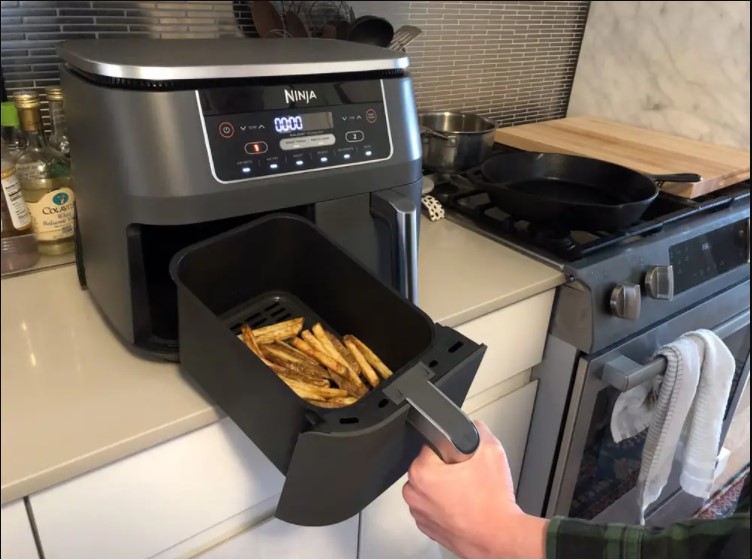
This screenshot has height=560, width=752. Find the location of `oven`. oven is located at coordinates (578, 423).